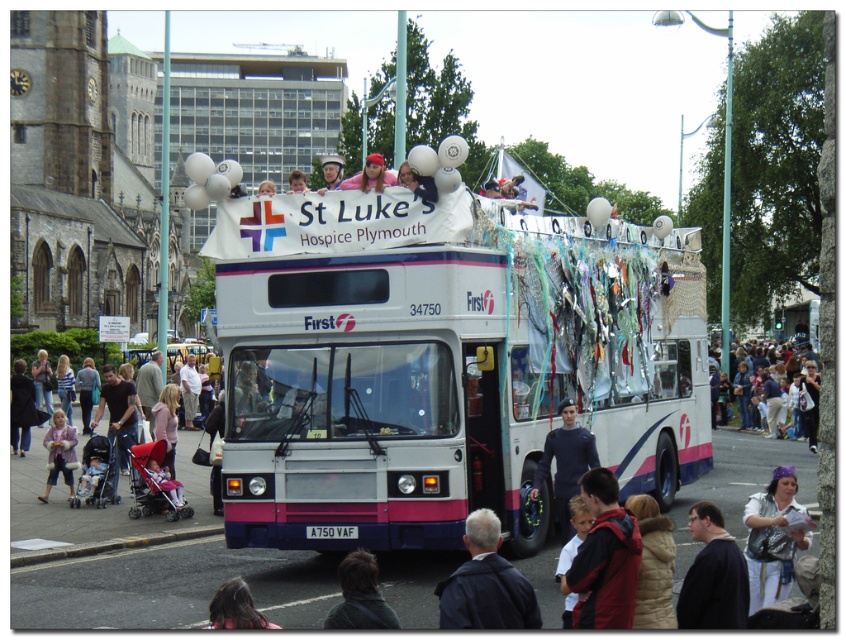
Question: Which of the following is the closest to the observer?

Choices:
 (A) (246, 609)
 (B) (613, 579)
 (C) (61, 461)

Answer: (A)

Question: Among these points, which one is farthest from the camera?

Choices:
 (A) (536, 605)
 (B) (106, 387)
 (C) (779, 580)

Answer: (B)

Question: Is dark blue sweater at center closer to camera compared to dark brown hair at lower left?

Choices:
 (A) no
 (B) yes

Answer: (A)

Question: Which point is farther from the camera taking this photo?

Choices:
 (A) (465, 627)
 (B) (570, 451)
 (C) (360, 588)

Answer: (B)

Question: Does dark blue jacket at center have a lesser width compared to dark brown hair at lower center?

Choices:
 (A) no
 (B) yes

Answer: (A)

Question: Can you confirm if white glossy/decorative decker bus at center is thinner than dark brown hair at lower center?

Choices:
 (A) yes
 (B) no

Answer: (B)